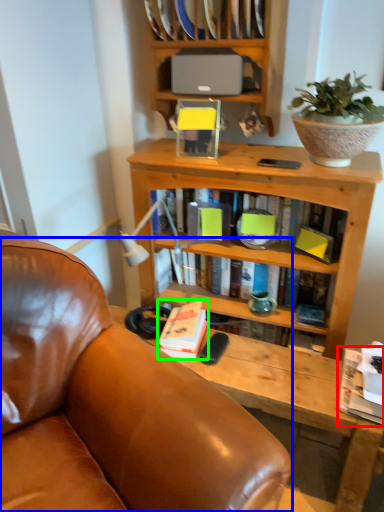
Question: Based on their relative distances, which object is nearer to book (highlighted by a red box)? Choose from chair (highlighted by a blue box) and book (highlighted by a green box).

Choices:
 (A) chair
 (B) book

Answer: (B)